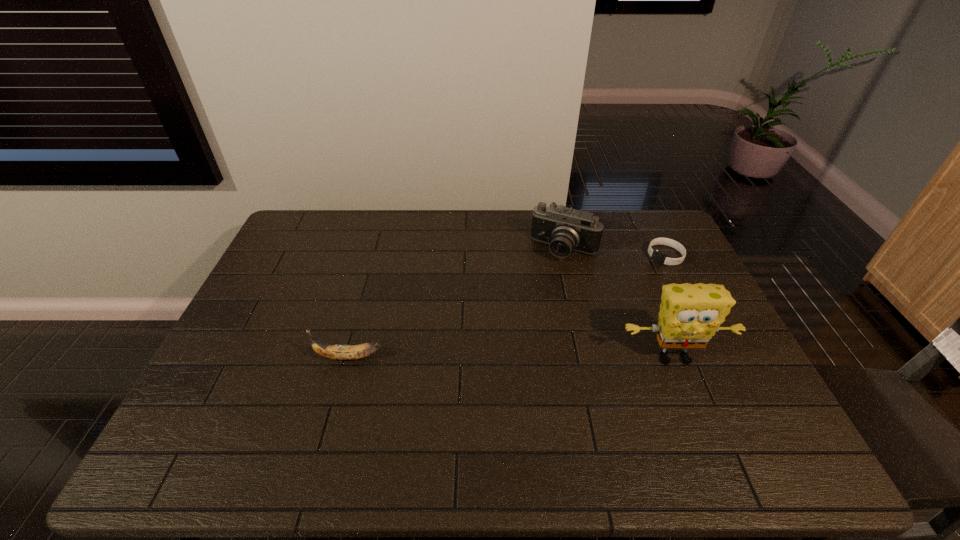
Find the location of a particular element. The height and width of the screenshot is (540, 960). vacant space that is in between the third tallest object and the sponge is located at coordinates (511, 357).

The width and height of the screenshot is (960, 540). In order to click on free space between the banana and the shortest object in this screenshot , I will do `click(507, 307)`.

Identify the location of vacant area between the leftmost object and the sponge. This screenshot has height=540, width=960. (511, 357).

Select which object is the third closest to the tallest object. Please provide its 2D coordinates. Your answer should be formatted as a tuple, i.e. [(x, y)], where the tuple contains the x and y coordinates of a point satisfying the conditions above.

[(337, 352)]

Choose which object is the second nearest neighbor to the camera. Please provide its 2D coordinates. Your answer should be formatted as a tuple, i.e. [(x, y)], where the tuple contains the x and y coordinates of a point satisfying the conditions above.

[(690, 314)]

In order to click on vacant area that satisfies the following two spatial constraints: 1. on the front side of the camera; 2. on the right side of the shortest object in this screenshot , I will do `click(566, 256)`.